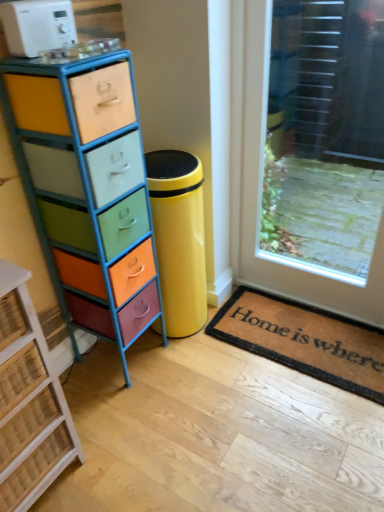
I want to click on free point above multicolored painted wood chest of drawers at left, which is the 1th chest of drawers from right to left (from a real-world perspective), so click(66, 53).